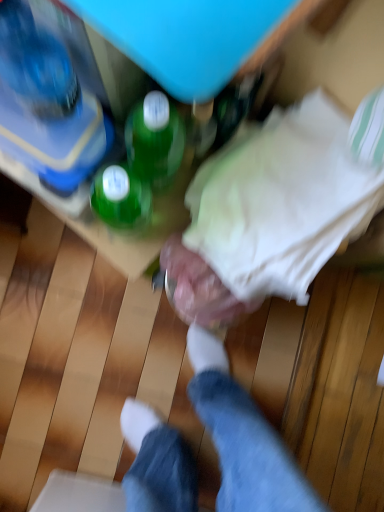
The width and height of the screenshot is (384, 512). Identify the location of translucent plastic bottle at upper left. pyautogui.click(x=46, y=103).

Which is behind, point (164, 185) or point (273, 113)?

The point (164, 185) is farther.

From the image's perspective, does green glass bottle at upper center appear lower than white fabric at center?

No.

Can you confirm if green glass bottle at upper center is thinner than white fabric at center?

Indeed, green glass bottle at upper center has a lesser width compared to white fabric at center.

Is point (94, 204) positioned in front of point (204, 294)?

Yes, point (94, 204) is closer to viewer.

From the image's perspective, which is below, green glass bottle at upper center or metallic silver dumbbell at center?

metallic silver dumbbell at center is shown below in the image.

From a real-world perspective, is green glass bottle at upper center on top of metallic silver dumbbell at center?

Yes, from a real-world perspective, green glass bottle at upper center is over metallic silver dumbbell at center

Is green glass bottle at upper center shorter than metallic silver dumbbell at center?

In fact, green glass bottle at upper center may be taller than metallic silver dumbbell at center.

Is point (176, 306) farther from camera compared to point (152, 157)?

Yes, point (176, 306) is behind point (152, 157).

From a real-world perspective, who is located higher, metallic silver dumbbell at center or green glass bottle at upper center?

In real-world perspective, green glass bottle at upper center is above.

From the image's perspective, between metallic silver dumbbell at center and green glass bottle at upper center, who is located below?

metallic silver dumbbell at center.

Considering the relative positions of metallic silver dumbbell at center and green glass bottle at upper center in the image provided, is metallic silver dumbbell at center to the right of green glass bottle at upper center from the viewer's perspective?

Correct, you'll find metallic silver dumbbell at center to the right of green glass bottle at upper center.

Is translucent plastic bottle at upper left inside the boundaries of green glass bottle at upper center, or outside?

translucent plastic bottle at upper left is not inside green glass bottle at upper center, it's outside.

Relative to green glass bottle at upper center, is translucent plastic bottle at upper left in front or behind?

Visually, translucent plastic bottle at upper left is located behind green glass bottle at upper center.

Does point (6, 70) appear closer or farther from the camera than point (159, 172)?

Clearly, point (6, 70) is closer to the camera than point (159, 172).

Looking at this image, based on their positions, is translucent plastic bottle at upper left located to the left or right of green glass bottle at upper center?

In the image, translucent plastic bottle at upper left appears on the left side of green glass bottle at upper center.

Where is `clothing located underneath the translucent plastic bottle at upper left (from a real-world perspective)`? The height and width of the screenshot is (512, 384). clothing located underneath the translucent plastic bottle at upper left (from a real-world perspective) is located at coordinates (287, 198).

Is point (364, 138) in front of point (52, 41)?

No.

Is white fabric at center at the left side of translucent plastic bottle at upper left?

In fact, white fabric at center is to the right of translucent plastic bottle at upper left.

Looking at this image, in terms of width, does white fabric at center look wider or thinner when compared to translucent plastic bottle at upper left?

Considering their sizes, white fabric at center looks broader than translucent plastic bottle at upper left.

Would you consider green glass bottle at upper center to be distant from translucent plastic bottle at upper left?

That's not correct — green glass bottle at upper center is a little close to translucent plastic bottle at upper left.

From the image's perspective, does green glass bottle at upper center appear lower than translucent plastic bottle at upper left?

Yes, from the image's perspective, green glass bottle at upper center is below translucent plastic bottle at upper left.

Which is behind, green glass bottle at upper center or translucent plastic bottle at upper left?

translucent plastic bottle at upper left.

How many degrees apart are the facing directions of green glass bottle at upper center and translucent plastic bottle at upper left?

0.000104 degrees.

Looking at this image, from the image's perspective, which object appears higher, translucent plastic bottle at upper left or white fabric at center?

translucent plastic bottle at upper left appears higher in the image.

Is translucent plastic bottle at upper left in front of white fabric at center?

No, translucent plastic bottle at upper left is further to the viewer.

Is translucent plastic bottle at upper left not within white fabric at center?

Yes, translucent plastic bottle at upper left is not within white fabric at center.

Identify the location of beverage that is in front of the white fabric at center. This screenshot has height=512, width=384. (141, 163).

At what (x,y) coordinates should I click in order to perform the action: click on beverage located on the left of metallic silver dumbbell at center. Please return your answer as a coordinate pair (x, y). This screenshot has width=384, height=512. Looking at the image, I should click on (141, 163).

Which object lies further to the anchor point green glass bottle at upper center, metallic silver dumbbell at center or white fabric at center?

The object further to green glass bottle at upper center is white fabric at center.

When comparing their distances from white fabric at center, does translucent plastic bottle at upper left or green glass bottle at upper center seem closer?

green glass bottle at upper center lies closer to white fabric at center than the other object.

Estimate the real-world distances between objects in this image. Which object is closer to white fabric at center, green glass bottle at upper center or metallic silver dumbbell at center?

metallic silver dumbbell at center lies closer to white fabric at center than the other object.

Considering their positions, is metallic silver dumbbell at center positioned further to white fabric at center than translucent plastic bottle at upper left?

Based on the image, translucent plastic bottle at upper left appears to be further to white fabric at center.

Considering their positions, is green glass bottle at upper center positioned further to metallic silver dumbbell at center than translucent plastic bottle at upper left?

The object further to metallic silver dumbbell at center is translucent plastic bottle at upper left.

Looking at the image, which one is located further to white fabric at center, translucent plastic bottle at upper left or metallic silver dumbbell at center?

translucent plastic bottle at upper left lies further to white fabric at center than the other object.

Estimate the real-world distances between objects in this image. Which object is further from green glass bottle at upper center, translucent plastic bottle at upper left or white fabric at center?

Among the two, white fabric at center is located further to green glass bottle at upper center.

Considering their positions, is green glass bottle at upper center positioned further to translucent plastic bottle at upper left than white fabric at center?

white fabric at center is positioned further to the anchor translucent plastic bottle at upper left.

Locate an element on the screen. head between translucent plastic bottle at upper left and white fabric at center from left to right is located at coordinates (197, 289).

Locate an element on the screen. beverage located between translucent plastic bottle at upper left and white fabric at center in the left-right direction is located at coordinates (141, 163).

This screenshot has width=384, height=512. What are the coordinates of `beverage between translucent plastic bottle at upper left and metallic silver dumbbell at center in the vertical direction` in the screenshot? It's located at (141, 163).

Identify the location of clothing between green glass bottle at upper center and metallic silver dumbbell at center from front to back. The width and height of the screenshot is (384, 512). (287, 198).